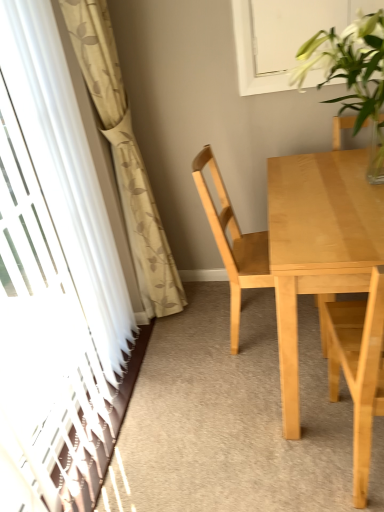
In order to click on empty space that is ontop of light wood table at center (from a real-world perspective) in this screenshot , I will do `click(334, 190)`.